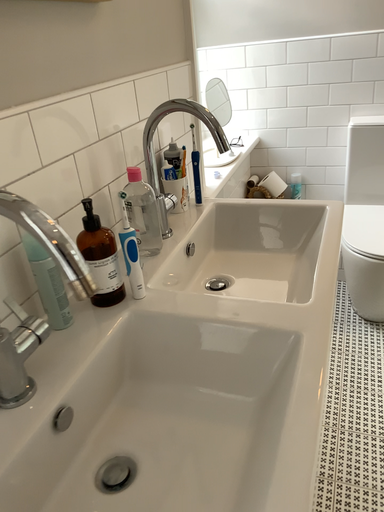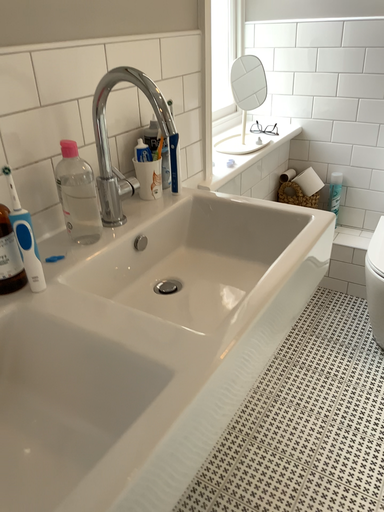
Question: How did the camera likely rotate when shooting the video?

Choices:
 (A) rotated left
 (B) rotated right

Answer: (A)